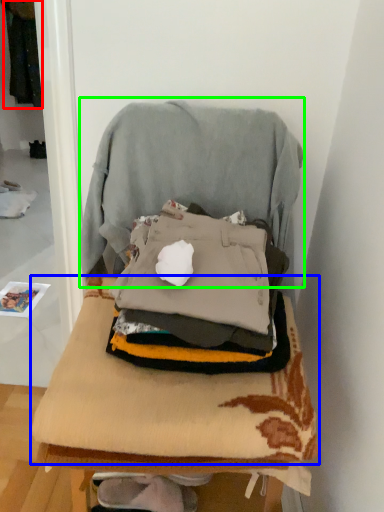
Question: Estimate the real-world distances between objects in this image. Which object is farther from clothing (highlighted by a red box), blanket (highlighted by a blue box) or swivel chair (highlighted by a green box)?

Choices:
 (A) blanket
 (B) swivel chair

Answer: (A)